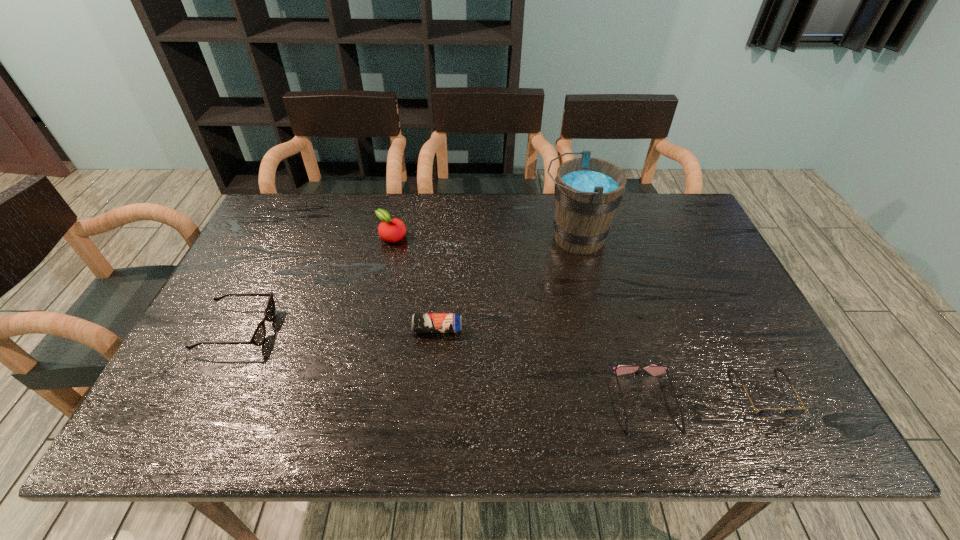
What are the coordinates of `free space that is in between the tallest object and the beer can` in the screenshot? It's located at (506, 284).

At what (x,y) coordinates should I click in order to perform the action: click on empty space between the second tallest sunglasses and the fifth object from right to left. Please return your answer as a coordinate pair (x, y). This screenshot has height=540, width=960. Looking at the image, I should click on (519, 319).

Locate an element on the screen. The width and height of the screenshot is (960, 540). empty location between the second tallest object and the tallest sunglasses is located at coordinates (315, 283).

You are a GUI agent. You are given a task and a screenshot of the screen. Output one action in this format:
    pyautogui.click(x=<x>, y=<y>)
    Task: Click on the vacant space that's between the shortest object and the second sunglasses from right to left
    
    Given the screenshot: What is the action you would take?
    pyautogui.click(x=706, y=397)

Where is `vacant region between the tallest sunglasses and the fourth object from right to left`? The width and height of the screenshot is (960, 540). vacant region between the tallest sunglasses and the fourth object from right to left is located at coordinates (338, 329).

What are the coordinates of `the fifth closest object to the beer can` in the screenshot? It's located at (768, 412).

Where is `object that is the closest to the second object from left to right`? Image resolution: width=960 pixels, height=540 pixels. object that is the closest to the second object from left to right is located at coordinates (421, 322).

Locate which sunglasses is the closest to the rightmost sunglasses. Please provide its 2D coordinates. Your answer should be formatted as a tuple, i.e. [(x, y)], where the tuple contains the x and y coordinates of a point satisfying the conditions above.

[(654, 370)]

Select which sunglasses appears as the closest to the beer can. Please provide its 2D coordinates. Your answer should be formatted as a tuple, i.e. [(x, y)], where the tuple contains the x and y coordinates of a point satisfying the conditions above.

[(258, 337)]